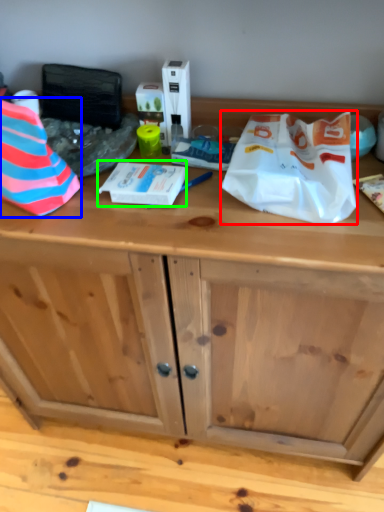
Question: Which object is the farthest from wrapping paper (highlighted by a red box)? Choose among these: wrapping paper (highlighted by a blue box) or wrapping paper (highlighted by a green box).

Choices:
 (A) wrapping paper
 (B) wrapping paper

Answer: (A)